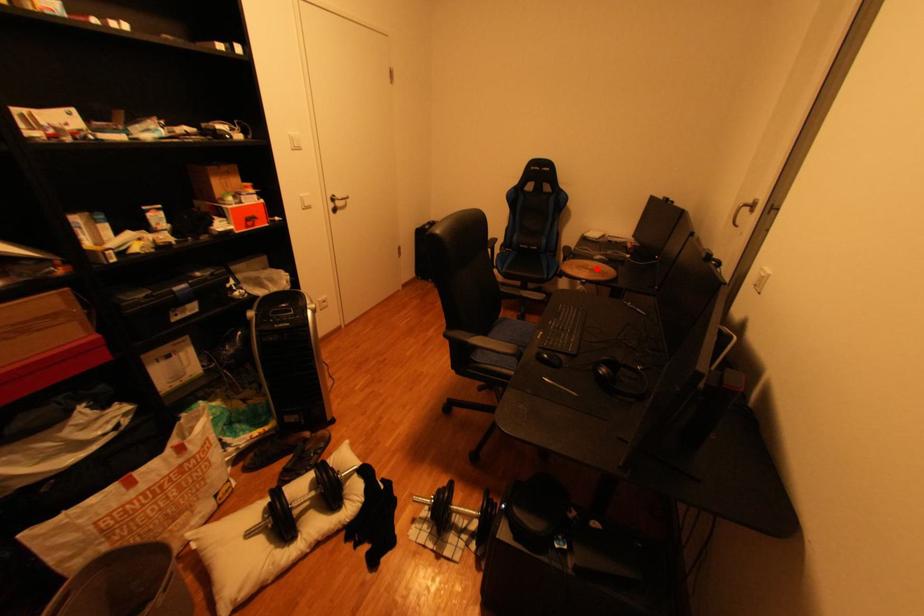
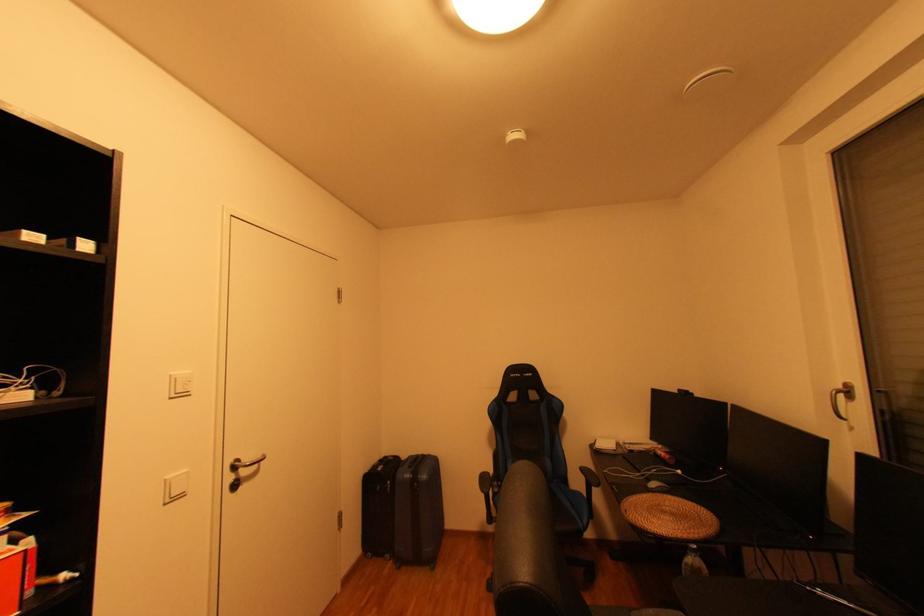
Locate, in the second image, the point that corresponds to the highlighted location in the first image.

(674, 513)